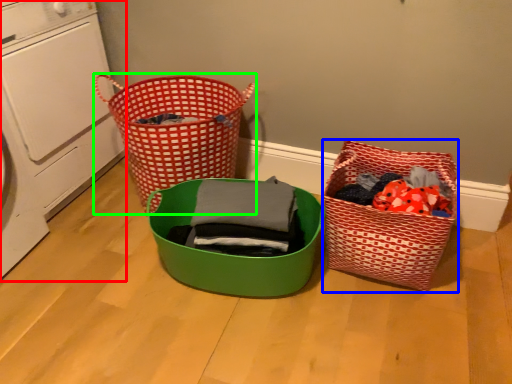
Question: Based on their relative distances, which object is nearer to washing machine (highlighted by a red box)? Choose from basket (highlighted by a blue box) and waste container (highlighted by a green box).

Choices:
 (A) basket
 (B) waste container

Answer: (B)